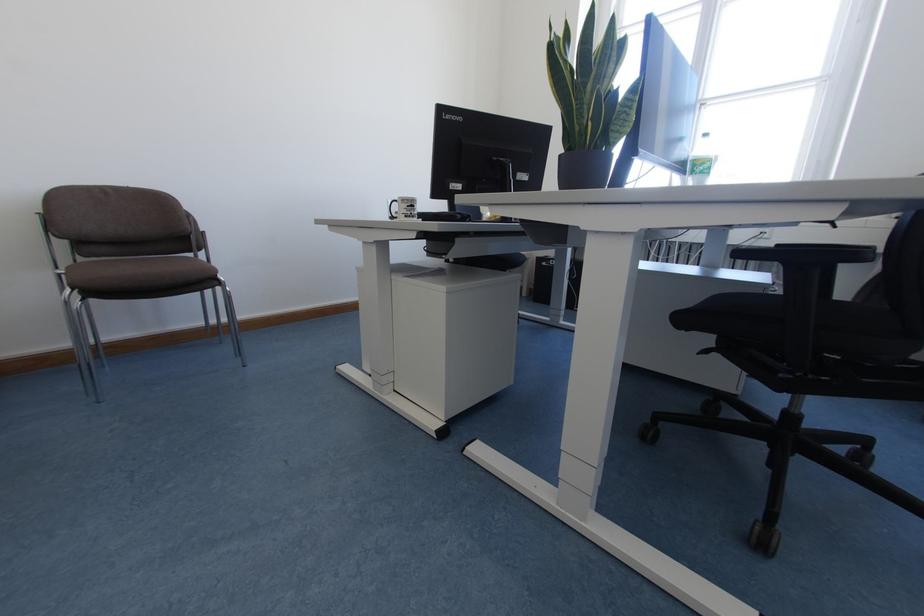
The width and height of the screenshot is (924, 616). Describe the element at coordinates (850, 249) in the screenshot. I see `a black chair armrest` at that location.